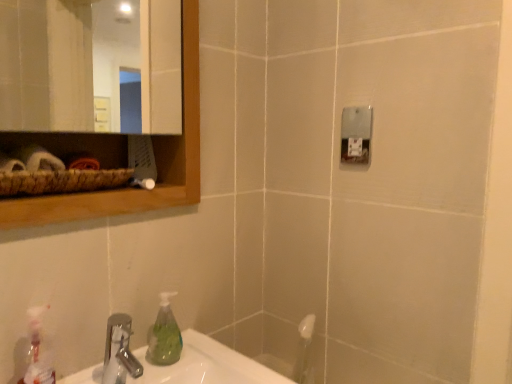
Question: From the image's perspective, is wooden mirror at upper left on translucent plastic spray bottle at lower left?

Choices:
 (A) yes
 (B) no

Answer: (A)

Question: Is the position of wooden mirror at upper left less distant than that of translucent plastic spray bottle at lower left?

Choices:
 (A) no
 (B) yes

Answer: (B)

Question: Would you consider wooden mirror at upper left to be distant from translucent plastic spray bottle at lower left?

Choices:
 (A) no
 (B) yes

Answer: (B)

Question: Is wooden mirror at upper left placed right next to translucent plastic spray bottle at lower left?

Choices:
 (A) yes
 (B) no

Answer: (B)

Question: Considering the relative sizes of wooden mirror at upper left and translucent plastic spray bottle at lower left in the image provided, is wooden mirror at upper left thinner than translucent plastic spray bottle at lower left?

Choices:
 (A) yes
 (B) no

Answer: (A)

Question: From the image's perspective, relative to green translucent soap dispenser at lower left, is translucent plastic spray bottle at lower left above or below?

Choices:
 (A) below
 (B) above

Answer: (A)

Question: In the image, is translucent plastic spray bottle at lower left positioned in front of or behind green translucent soap dispenser at lower left?

Choices:
 (A) behind
 (B) front

Answer: (B)

Question: Is translucent plastic spray bottle at lower left inside the boundaries of green translucent soap dispenser at lower left, or outside?

Choices:
 (A) outside
 (B) inside

Answer: (A)

Question: Based on their sizes in the image, would you say translucent plastic spray bottle at lower left is bigger or smaller than green translucent soap dispenser at lower left?

Choices:
 (A) big
 (B) small

Answer: (A)

Question: Considering their positions, is green translucent soap dispenser at lower left located in front of or behind wooden mirror at upper left?

Choices:
 (A) behind
 (B) front

Answer: (A)

Question: Looking at their shapes, would you say green translucent soap dispenser at lower left is wider or thinner than wooden mirror at upper left?

Choices:
 (A) thin
 (B) wide

Answer: (B)

Question: In terms of size, does green translucent soap dispenser at lower left appear bigger or smaller than wooden mirror at upper left?

Choices:
 (A) big
 (B) small

Answer: (B)

Question: Is point (164, 354) positioned closer to the camera than point (67, 21)?

Choices:
 (A) farther
 (B) closer

Answer: (B)

Question: Considering the positions of silver metallic faucet at lower left and green translucent soap dispenser at lower left in the image, is silver metallic faucet at lower left bigger or smaller than green translucent soap dispenser at lower left?

Choices:
 (A) big
 (B) small

Answer: (A)

Question: Is silver metallic faucet at lower left inside or outside of green translucent soap dispenser at lower left?

Choices:
 (A) outside
 (B) inside

Answer: (A)